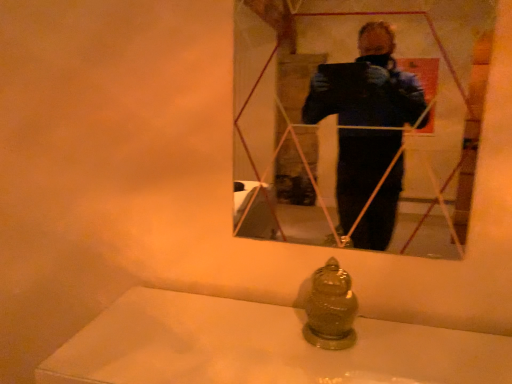
Question: In terms of width, does matte ceramic bath at lower center look wider or thinner when compared to matte glass mirror at upper center?

Choices:
 (A) thin
 (B) wide

Answer: (B)

Question: Based on their positions, is matte ceramic bath at lower center located to the left or right of matte glass mirror at upper center?

Choices:
 (A) left
 (B) right

Answer: (A)

Question: Is point (143, 329) positioned closer to the camera than point (309, 114)?

Choices:
 (A) closer
 (B) farther

Answer: (A)

Question: From the image's perspective, is matte glass mirror at upper center located above or below matte ceramic bath at lower center?

Choices:
 (A) below
 (B) above

Answer: (B)

Question: Choose the correct answer: Is matte glass mirror at upper center inside matte ceramic bath at lower center or outside it?

Choices:
 (A) inside
 (B) outside

Answer: (B)

Question: Is point (371, 129) positioned closer to the camera than point (331, 352)?

Choices:
 (A) farther
 (B) closer

Answer: (A)

Question: From a real-world perspective, is matte glass mirror at upper center physically located above or below matte ceramic bath at lower center?

Choices:
 (A) below
 (B) above

Answer: (B)